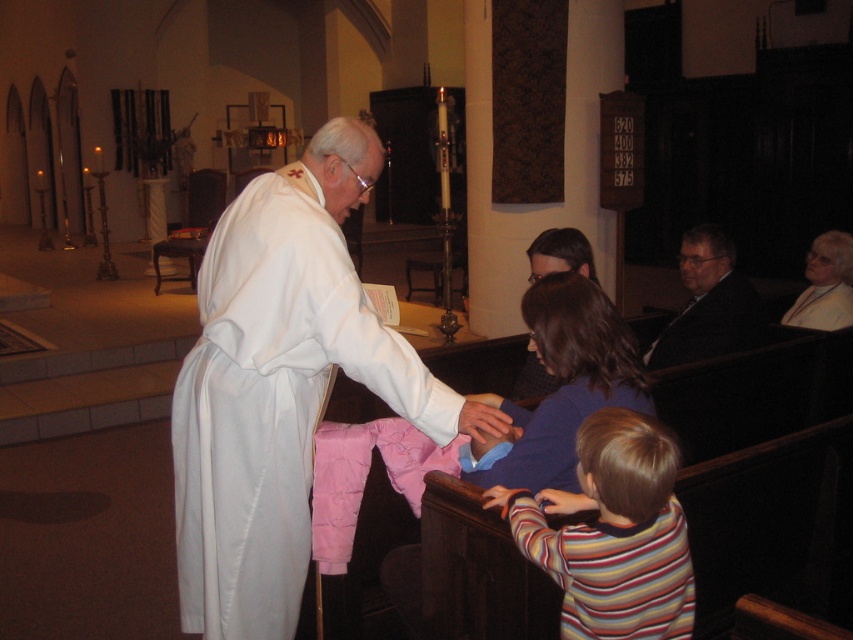
You are standing at the entrance of the church and want to locate the striped cotton shirt at lower right. According to the coordinates provided, where should you look to find it?

The striped cotton shirt at lower right is located at coordinates point (613, 532), which means it is positioned near the bottom right corner of the image.

You are standing at the back of the church and see both the white clothed figure at center and the matte white robe at center. Which one is more to your left?

The white clothed figure at center is positioned on the left side of matte white robe at center, so the white clothed figure at center is more to your left.